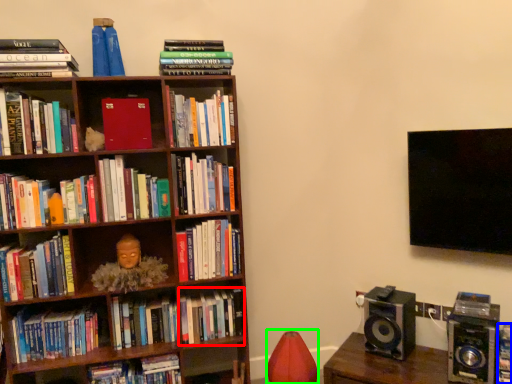
Question: Estimate the real-world distances between objects in this image. Which object is farther from book (highlighted by a red box), book (highlighted by a blue box) or bean bag chair (highlighted by a green box)?

Choices:
 (A) book
 (B) bean bag chair

Answer: (A)